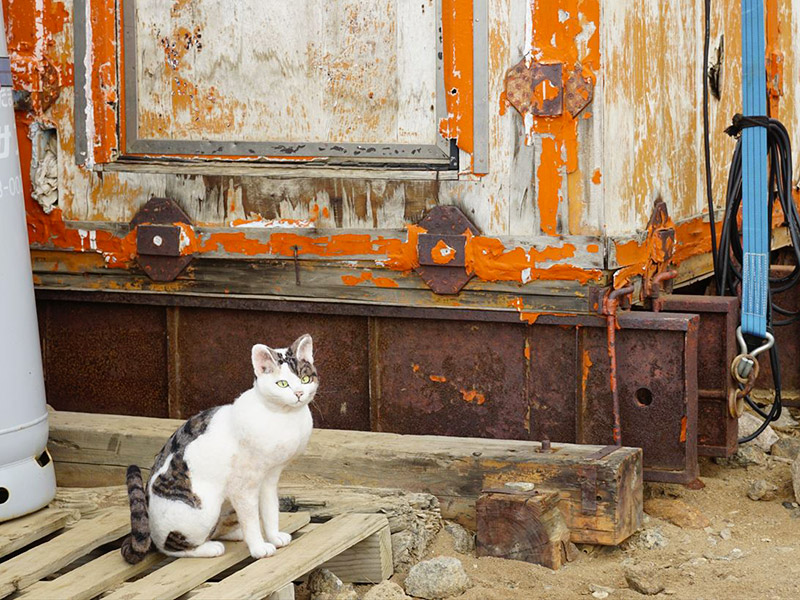
The image size is (800, 600). What are the coordinates of `wall` in the screenshot? It's located at (417, 118).